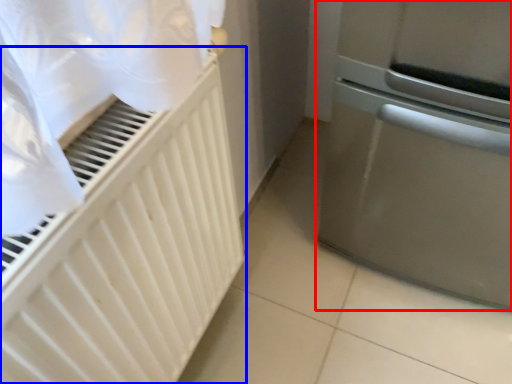
Question: Among these objects, which one is nearest to the camera, home appliance (highlighted by a red box) or radiator (highlighted by a blue box)?

Choices:
 (A) home appliance
 (B) radiator

Answer: (B)